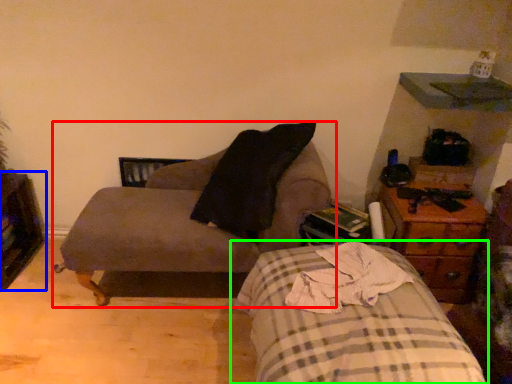
Question: Based on their relative distances, which object is farther from chair (highlighted by a red box)? Choose from dresser (highlighted by a blue box) and bed (highlighted by a green box).

Choices:
 (A) dresser
 (B) bed

Answer: (A)